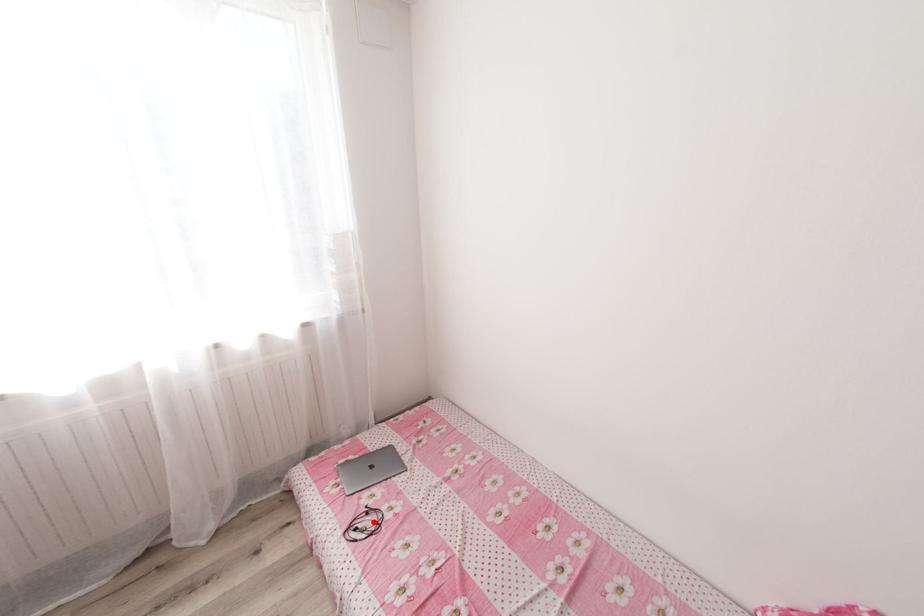
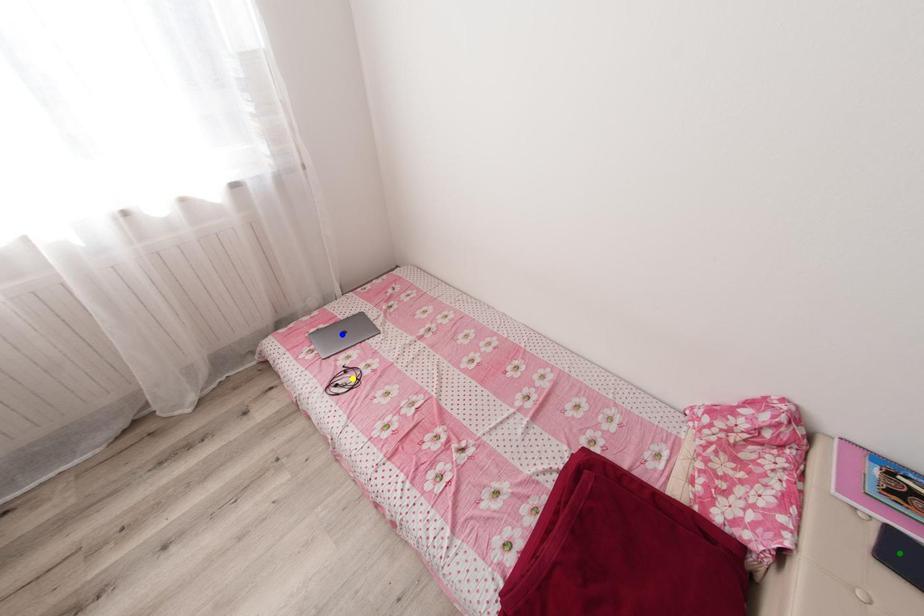
Question: I am providing you with two images of the same scene from different viewpoints. A red point is marked on the first image. You are given multiple points on the second image. Which point in image 2 is actually the same real-world point as the red point in image 1?

Choices:
 (A) yellow point
 (B) blue point
 (C) green point

Answer: (A)